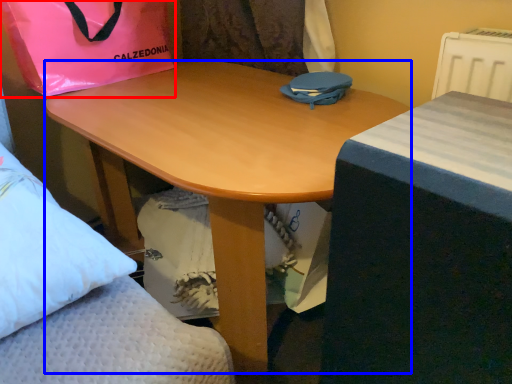
Question: Which object appears closest to the camera in this image, bag (highlighted by a red box) or desk (highlighted by a blue box)?

Choices:
 (A) bag
 (B) desk

Answer: (B)